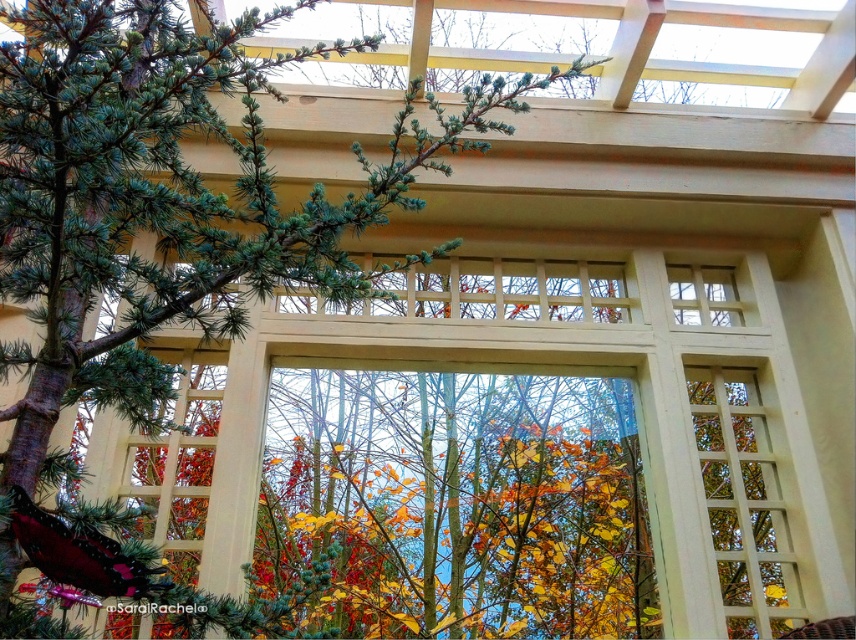
Is white lattice window at center above green needle-like at left?

No.

Is white lattice window at center behind green needle-like at left?

Yes, it is.

Locate an element on the screen. The width and height of the screenshot is (856, 640). white lattice window at center is located at coordinates (501, 452).

At what (x,y) coordinates should I click in order to perform the action: click on white lattice window at center. Please return your answer as a coordinate pair (x, y). Looking at the image, I should click on (501, 452).